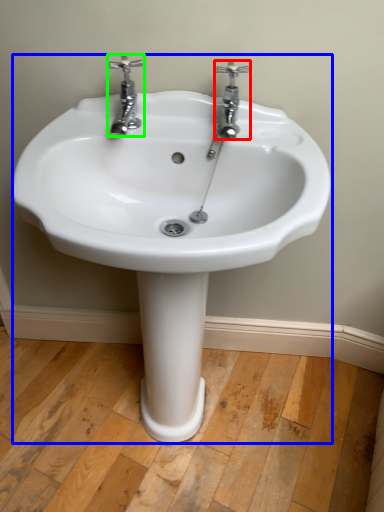
Question: Estimate the real-world distances between objects in this image. Which object is closer to tap (highlighted by a red box), sink (highlighted by a blue box) or tap (highlighted by a green box)?

Choices:
 (A) sink
 (B) tap

Answer: (B)